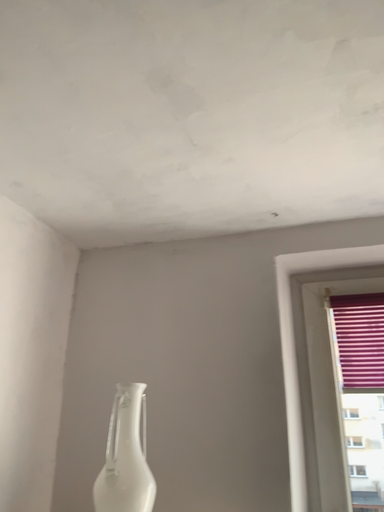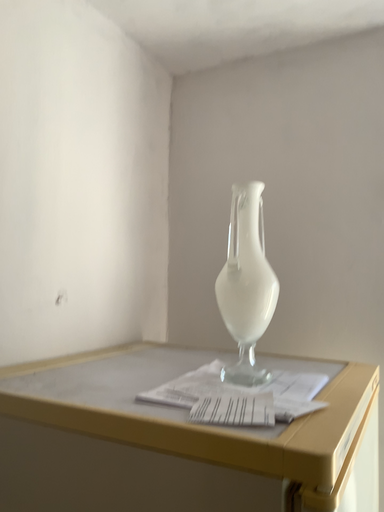
Question: How did the camera likely rotate when shooting the video?

Choices:
 (A) rotated left
 (B) rotated right

Answer: (A)